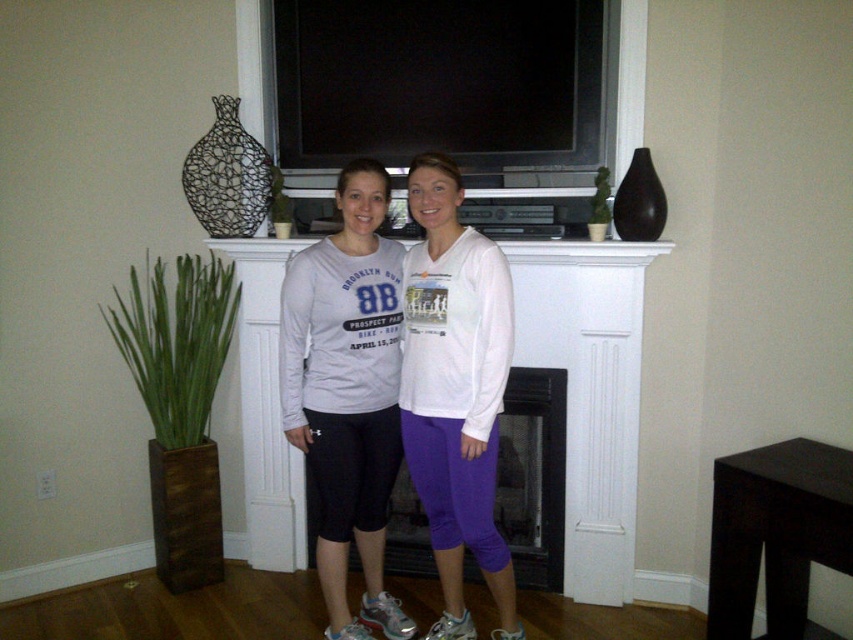
Question: Which object is farther from the camera taking this photo?

Choices:
 (A) black glass fireplace at center
 (B) matte gray sweatshirt at center
 (C) purple cotton leggings at center

Answer: (A)

Question: Which object is farther from the camera taking this photo?

Choices:
 (A) matte gray sweatshirt at center
 (B) black glass fireplace at center

Answer: (B)

Question: Does purple cotton leggings at center appear over black glass fireplace at center?

Choices:
 (A) no
 (B) yes

Answer: (B)

Question: Does purple cotton leggings at center have a smaller size compared to black glass fireplace at center?

Choices:
 (A) yes
 (B) no

Answer: (A)

Question: Which is farther from the purple cotton leggings at center?

Choices:
 (A) matte gray sweatshirt at center
 (B) black glass fireplace at center

Answer: (B)

Question: Is matte gray sweatshirt at center further to camera compared to purple cotton leggings at center?

Choices:
 (A) yes
 (B) no

Answer: (A)